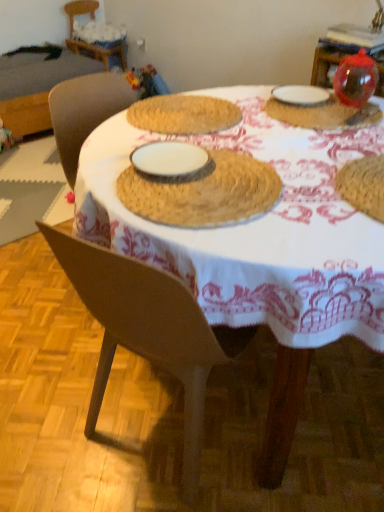
The width and height of the screenshot is (384, 512). I want to click on free space between white ceramic plate at upper right, marked as the 3th tableware in a right-to-left arrangement, and transparent plastic ornament at upper right, the third tableware from the left, so click(x=330, y=103).